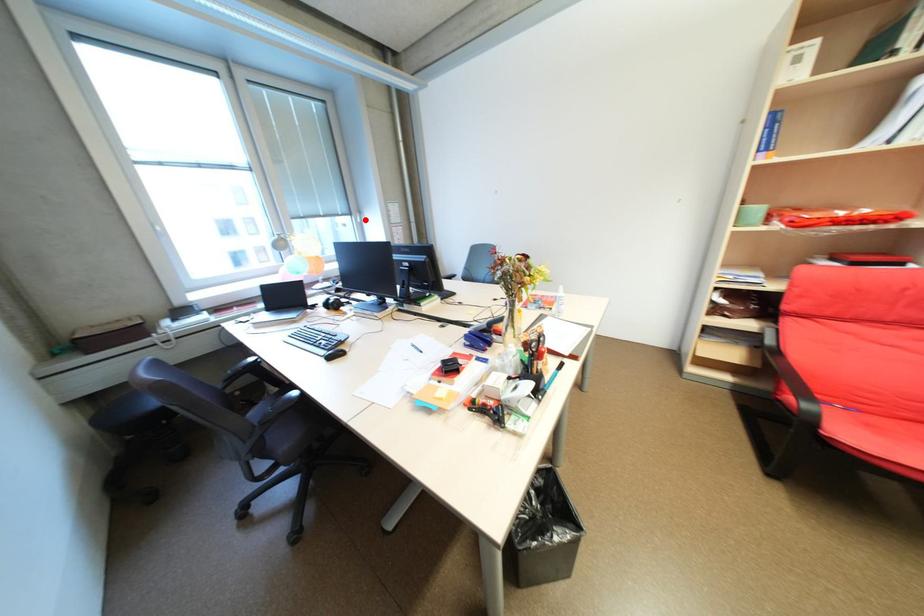
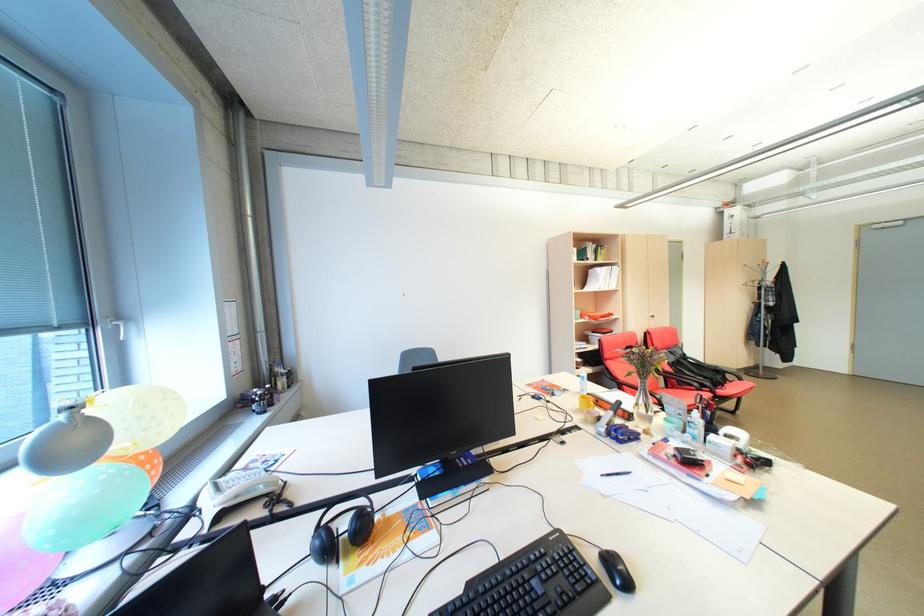
Question: I am providing you with two images of the same scene from different viewpoints. A red point is marked on the first image. Can you still see the location of the red point in image 2?

Choices:
 (A) Yes
 (B) No

Answer: (A)